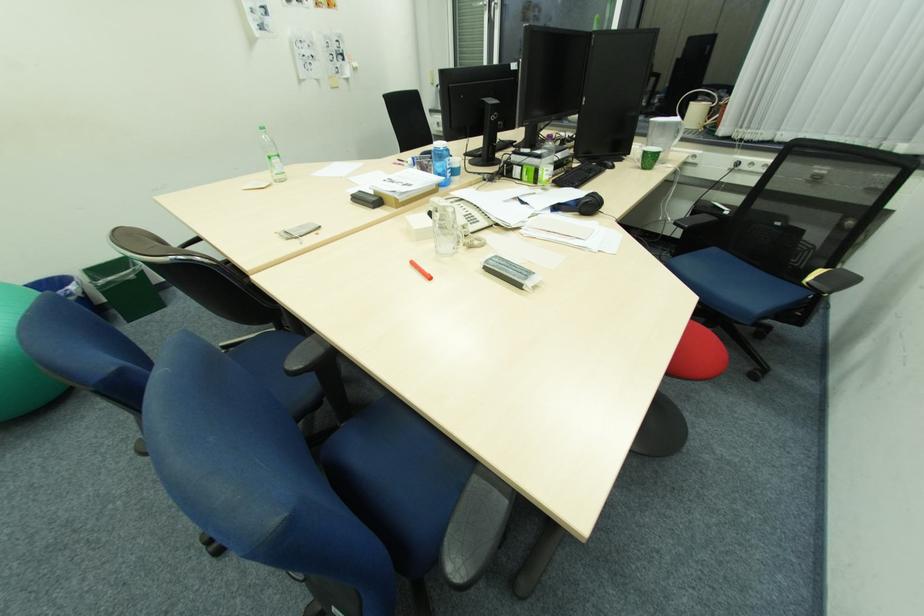
Which object does [66,290] point to?

This point indicates the blue trash can.